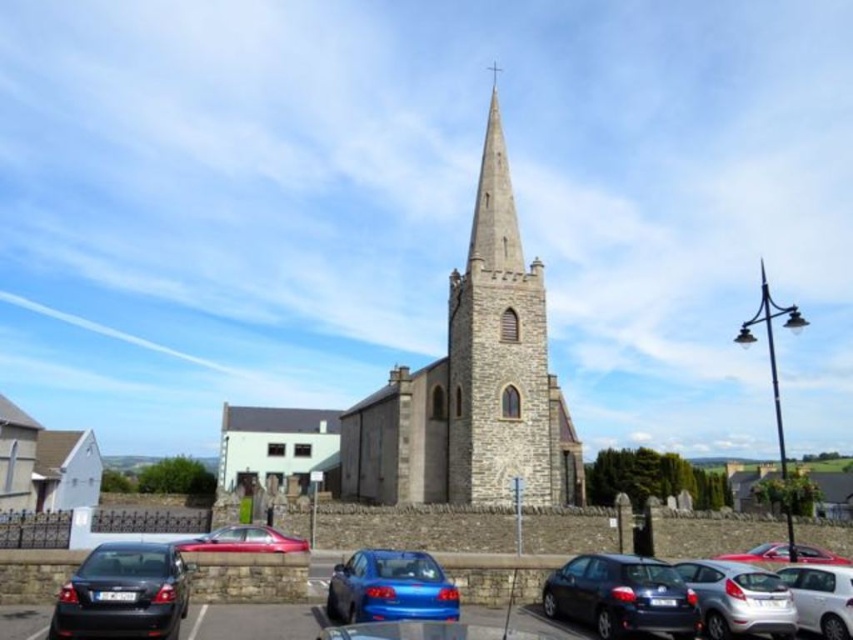
Does point (548, 420) come farther from viewer compared to point (572, 620)?

Yes, point (548, 420) is farther from viewer.

Between point (553, 484) and point (656, 600), which one is positioned in front?

Point (656, 600) is more forward.

What do you see at coordinates (473, 381) in the screenshot? This screenshot has width=853, height=640. I see `stone steeple at center` at bounding box center [473, 381].

Where is `stone steeple at center`? Image resolution: width=853 pixels, height=640 pixels. stone steeple at center is located at coordinates (473, 381).

Does point (248, 552) lie behind point (793, 548)?

No, it is not.

Which is more to the left, glossy metallic car at lower left or glossy metallic car at lower right?

glossy metallic car at lower left is more to the left.

Describe the element at coordinates (244, 540) in the screenshot. I see `glossy metallic car at lower left` at that location.

Find the location of a particular element. The image size is (853, 640). glossy metallic car at lower left is located at coordinates (244, 540).

Does metallic cars at lower center have a lesser width compared to silver metallic hatchback at lower right?

No, metallic cars at lower center is not thinner than silver metallic hatchback at lower right.

Locate an element on the screen. The image size is (853, 640). metallic cars at lower center is located at coordinates (253, 579).

Locate an element on the screen. This screenshot has height=640, width=853. metallic cars at lower center is located at coordinates (253, 579).